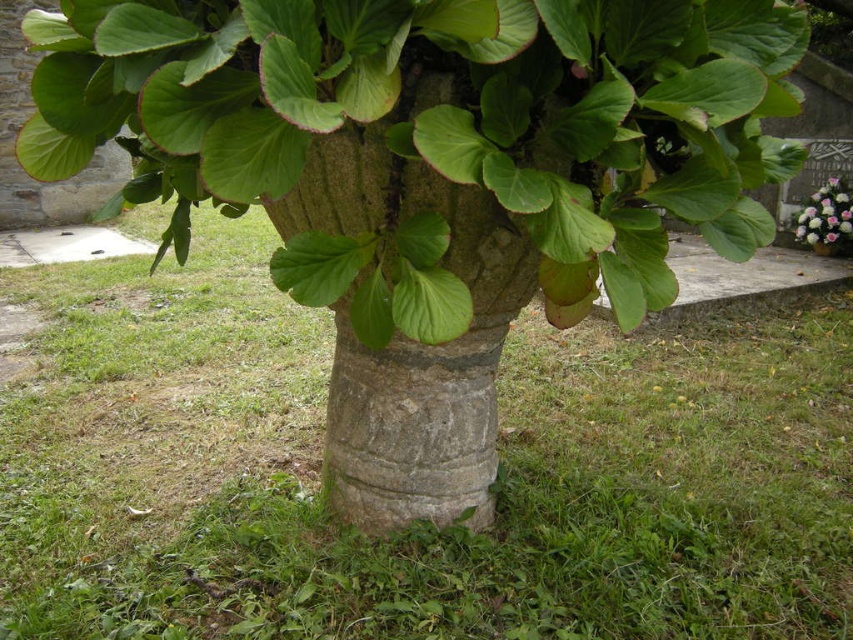
Question: Is smooth stone tree trunk at center above pink floral bouquet at upper right?

Choices:
 (A) yes
 (B) no

Answer: (B)

Question: Can you confirm if smooth stone tree trunk at center is thinner than pink floral bouquet at upper right?

Choices:
 (A) yes
 (B) no

Answer: (B)

Question: Can you confirm if smooth stone tree trunk at center is positioned to the left of pink floral bouquet at upper right?

Choices:
 (A) no
 (B) yes

Answer: (B)

Question: Which object is closer to the camera taking this photo?

Choices:
 (A) smooth stone tree trunk at center
 (B) pink floral bouquet at upper right

Answer: (A)

Question: Which point is farther to the camera?

Choices:
 (A) smooth stone tree trunk at center
 (B) pink floral bouquet at upper right

Answer: (B)